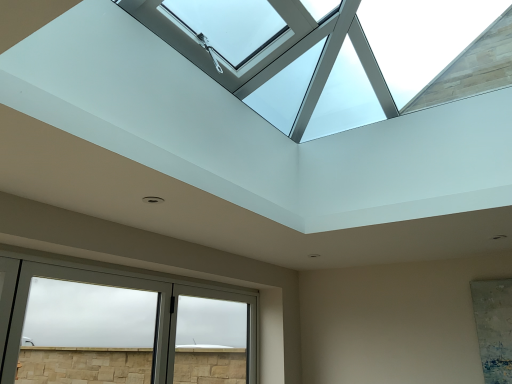
Measure the distance between point (223, 330) and camera.

A distance of 4.06 meters exists between point (223, 330) and camera.

The image size is (512, 384). What do you see at coordinates (213, 337) in the screenshot?
I see `frosted glass screen door at lower center` at bounding box center [213, 337].

The height and width of the screenshot is (384, 512). Find the location of `frosted glass screen door at lower center`. frosted glass screen door at lower center is located at coordinates (213, 337).

In order to click on frosted glass screen door at lower center in this screenshot , I will do `click(213, 337)`.